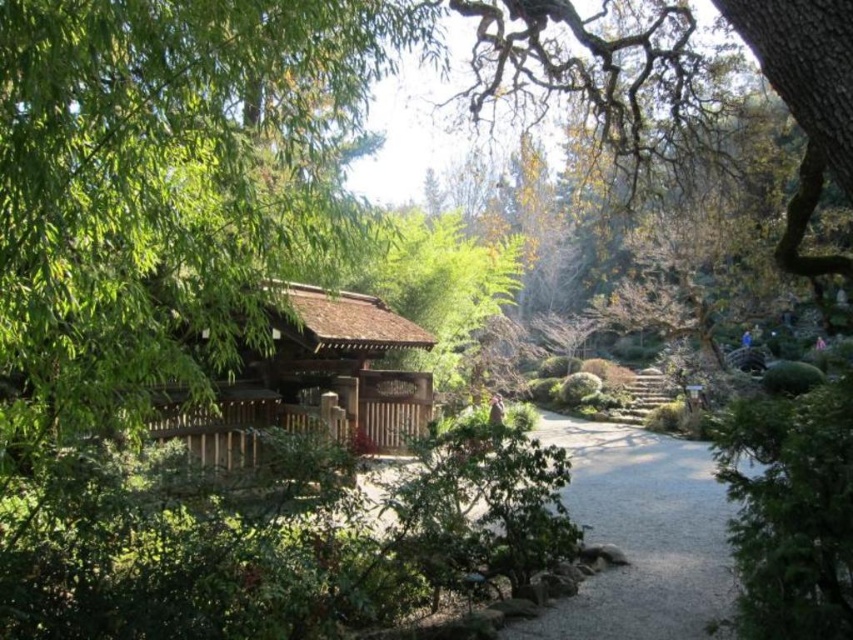
You are a visitor walking along the gray gravel path at center in the Japanese garden. As you approach the brown wooden gazebo at center, will the gazebo become more or less visible to you?

The gray gravel path at center is in front of the brown wooden gazebo at center, so as you walk along the path towards the gazebo, the gazebo will become more visible to you.

You are a visitor in the Japanese garden and want to take a photo of the brown wooden gazebo at center. However, there is a green leafy tree at left blocking your view. Can you determine if the tree is taller than the gazebo?

The green leafy tree at left is taller than brown wooden gazebo at center, so the tree will block your view of the gazebo.

You are standing at the entrance of the garden and want to reach the wooden pavilion at the center. There is a green leafy tree at left blocking your view. Can you walk around it to get to the pavilion?

The green leafy tree at left is 2.61 meters away from you. Since it is blocking your view, you can walk around it to reach the wooden pavilion at the center as the gravel pathway meanders through the garden, providing a path around obstacles.